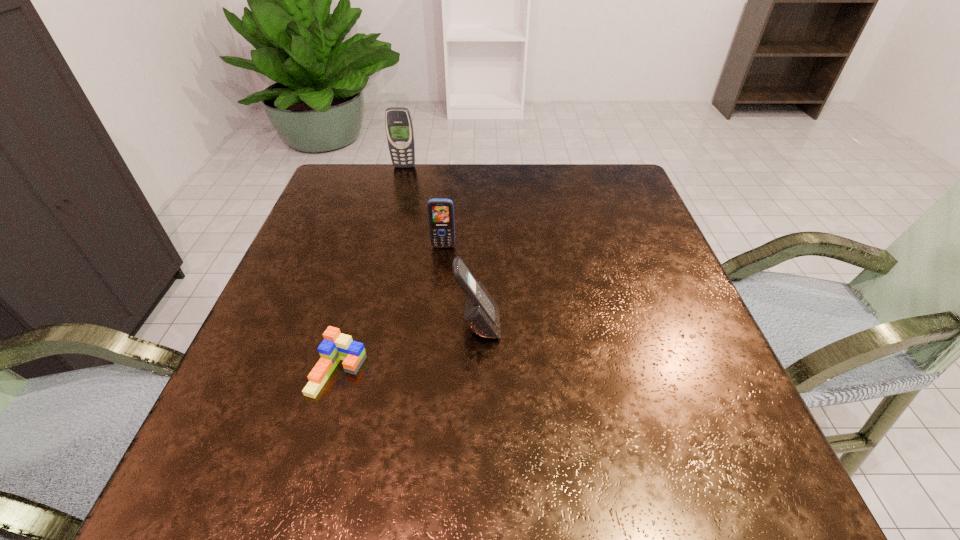
Locate an element on the screen. Image resolution: width=960 pixels, height=540 pixels. free space located 0.220m on the screen of the second object from right to left is located at coordinates (436, 322).

I want to click on vacant area situated on the right of the shortest object, so click(456, 372).

This screenshot has height=540, width=960. I want to click on object that is positioned at the far edge, so click(x=399, y=129).

You are a GUI agent. You are given a task and a screenshot of the screen. Output one action in this format:
    pyautogui.click(x=<x>, y=<y>)
    Task: Click on the object at the left edge
    The height and width of the screenshot is (540, 960).
    Given the screenshot: What is the action you would take?
    pyautogui.click(x=336, y=346)

Where is `free point at the far edge`? This screenshot has width=960, height=540. free point at the far edge is located at coordinates (499, 201).

Image resolution: width=960 pixels, height=540 pixels. In order to click on vacant region at the near edge of the desktop in this screenshot , I will do `click(438, 459)`.

Where is `vacant point at the right edge`? vacant point at the right edge is located at coordinates (643, 328).

In the image, there is a desktop. At what (x,y) coordinates should I click in order to perform the action: click on free space at the near left corner. Please return your answer as a coordinate pair (x, y). The image size is (960, 540). Looking at the image, I should click on (255, 480).

At what (x,y) coordinates should I click in order to perform the action: click on blank space at the far right corner of the desktop. Please return your answer as a coordinate pair (x, y). Looking at the image, I should click on (600, 200).

Where is `unoccupied area between the Lego and the nearest cellular telephone`? unoccupied area between the Lego and the nearest cellular telephone is located at coordinates (408, 349).